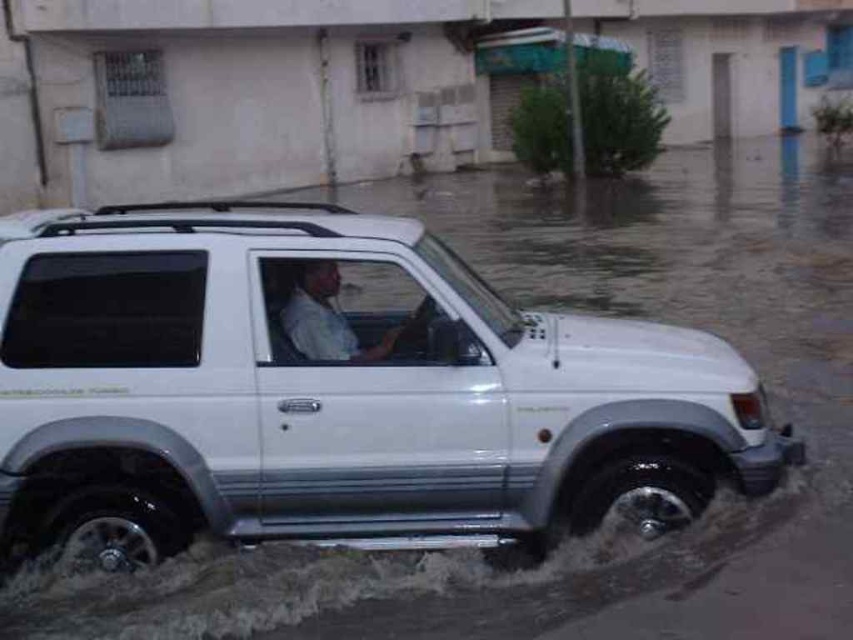
Question: Based on their relative distances, which object is nearer to the white matte shirt at center?

Choices:
 (A) silty gray mud at lower center
 (B) white matte suv at center

Answer: (A)

Question: Does white matte suv at center appear on the left side of silty gray mud at lower center?

Choices:
 (A) no
 (B) yes

Answer: (A)

Question: Estimate the real-world distances between objects in this image. Which object is farther from the white matte suv at center?

Choices:
 (A) white matte shirt at center
 (B) silty gray mud at lower center

Answer: (A)

Question: Does white matte suv at center appear on the left side of white matte shirt at center?

Choices:
 (A) no
 (B) yes

Answer: (A)

Question: Is white matte suv at center further to the viewer compared to silty gray mud at lower center?

Choices:
 (A) yes
 (B) no

Answer: (A)

Question: Which of the following is the closest to the observer?

Choices:
 (A) white matte suv at center
 (B) silty gray mud at lower center
 (C) white matte shirt at center

Answer: (B)